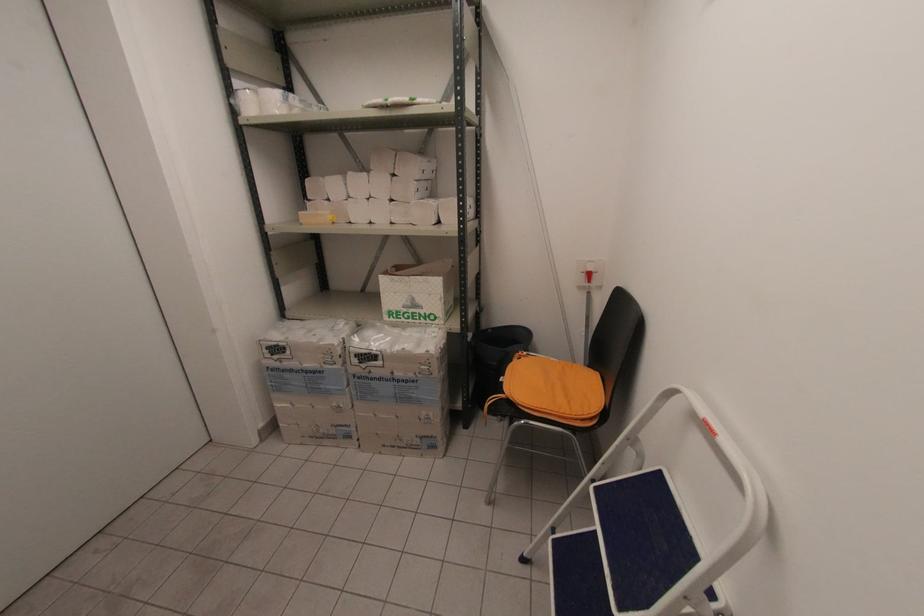
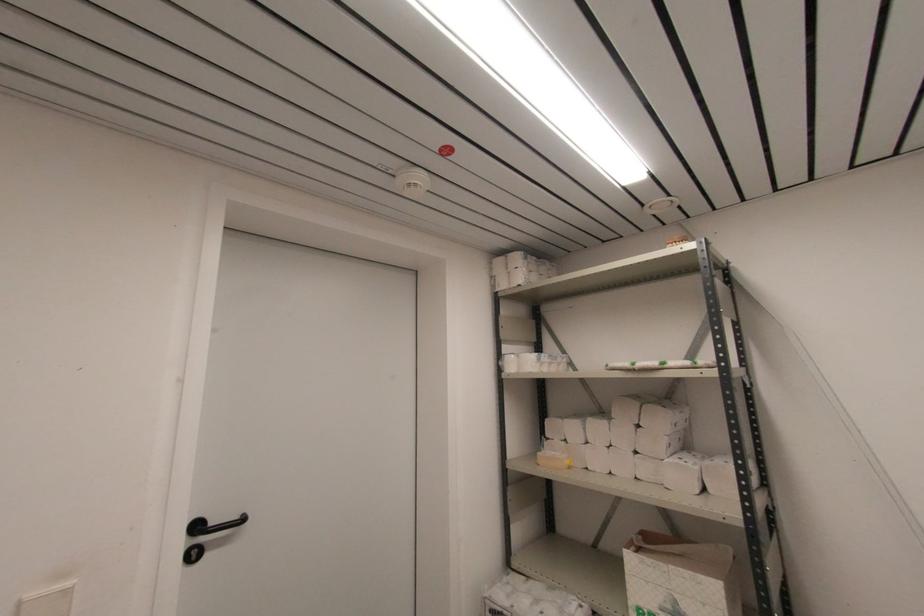
In the second image, find the point that corresponds to (x=302, y=225) in the first image.

(540, 464)